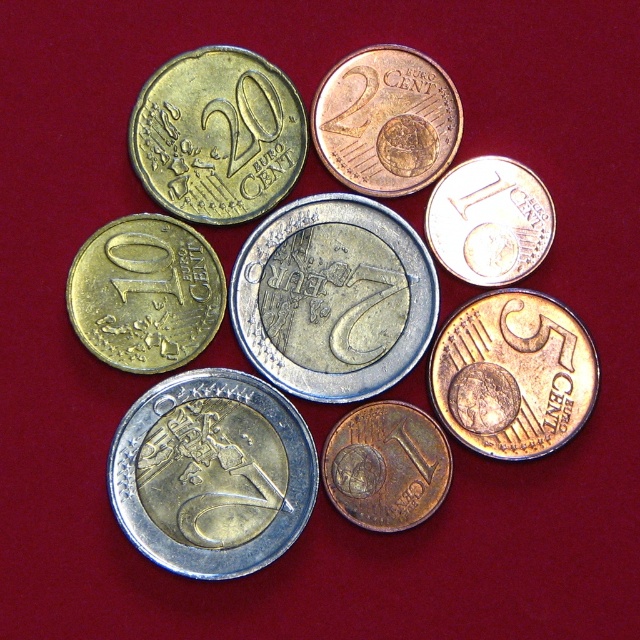
Is gold-plated coin at upper left above shiny copper coin at upper right?

Correct, gold-plated coin at upper left is located above shiny copper coin at upper right.

Who is shorter, gold-plated coin at upper left or shiny copper coin at upper right?

With less height is shiny copper coin at upper right.

Is point (234, 90) behind point (547, 230)?

Yes, it is.

Find the location of a particular element. gold-plated coin at upper left is located at coordinates (218, 134).

Is gold plated coin at upper center behind shiny copper coin at upper right?

Yes, gold plated coin at upper center is behind shiny copper coin at upper right.

Can you confirm if gold plated coin at upper center is bigger than shiny copper coin at upper right?

Yes, gold plated coin at upper center is bigger than shiny copper coin at upper right.

Find the location of a particular element. The width and height of the screenshot is (640, 640). gold plated coin at upper center is located at coordinates (387, 120).

In order to click on gold plated coin at upper center in this screenshot , I will do `click(387, 120)`.

Is silver/golden metallic coin at center closer to camera compared to gold plated coin at upper center?

Yes, it is.

Who is lower down, silver/golden metallic coin at center or gold plated coin at upper center?

silver/golden metallic coin at center is lower down.

Is point (236, 556) positioned in front of point (314, 122)?

Yes, it is in front of point (314, 122).

Identify the location of silver/golden metallic coin at center. Image resolution: width=640 pixels, height=640 pixels. (211, 474).